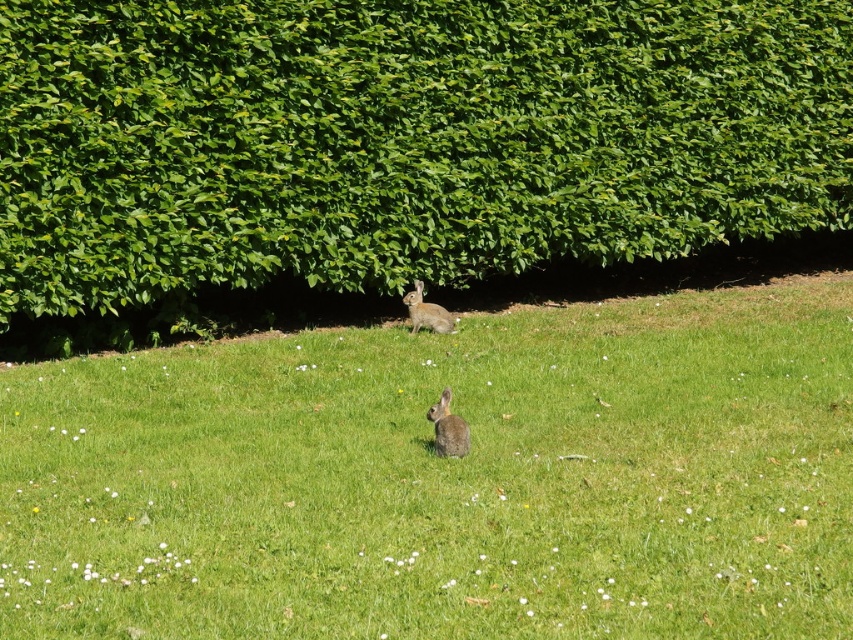
Who is positioned more to the left, green grassy at center or fuzzy brown rabbit at center?

fuzzy brown rabbit at center is more to the left.

Who is more forward, (68, 612) or (436, 323)?

Point (68, 612) is in front.

Is point (618, 458) positioned in front of point (405, 296)?

Yes.

This screenshot has width=853, height=640. I want to click on green grassy at center, so click(x=445, y=477).

Can you confirm if green grassy at center is positioned below green leafy hedge at center?

Yes.

Is point (676, 371) farther from viewer compared to point (772, 227)?

No, (676, 371) is in front of (772, 227).

Identify the location of green grassy at center. (445, 477).

Which is behind, point (335, 67) or point (412, 320)?

The point (412, 320) is behind.

Which is in front, point (814, 33) or point (436, 330)?

Point (436, 330) is in front.

Where is `green leafy hedge at center`? This screenshot has height=640, width=853. green leafy hedge at center is located at coordinates (393, 147).

Where is `green leafy hedge at center`? Image resolution: width=853 pixels, height=640 pixels. green leafy hedge at center is located at coordinates (393, 147).